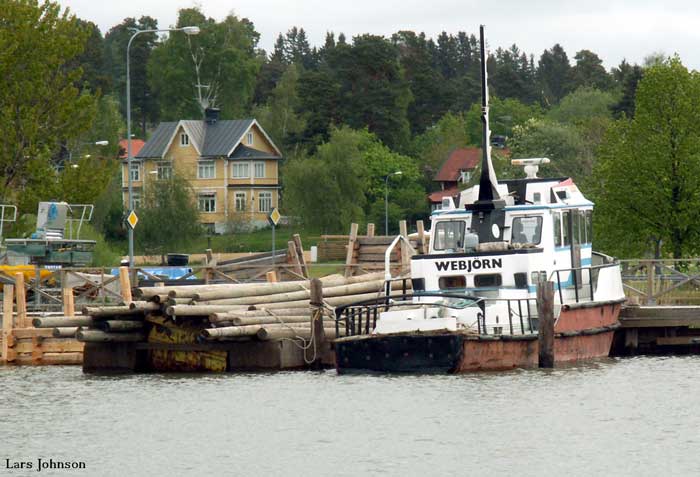
You are a GUI agent. You are given a task and a screenshot of the screen. Output one action in this format:
    pyautogui.click(x=<x>, y=<y>)
    Task: Click on the window
    The width and height of the screenshot is (700, 477).
    Given the screenshot: What is the action you would take?
    pyautogui.click(x=209, y=166), pyautogui.click(x=209, y=204)